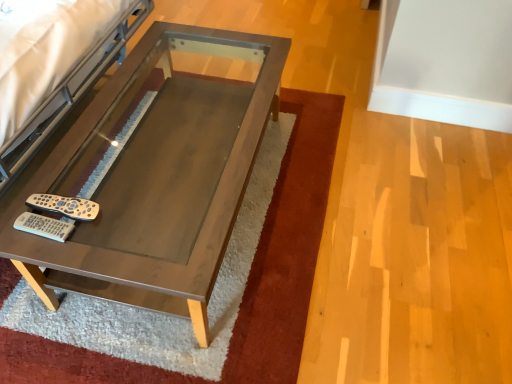
At what (x,y) coordinates should I click in order to perform the action: click on vacant space behind silver metallic remote at lower left. Please return your answer as a coordinate pair (x, y). The width and height of the screenshot is (512, 384). Looking at the image, I should click on (55, 161).